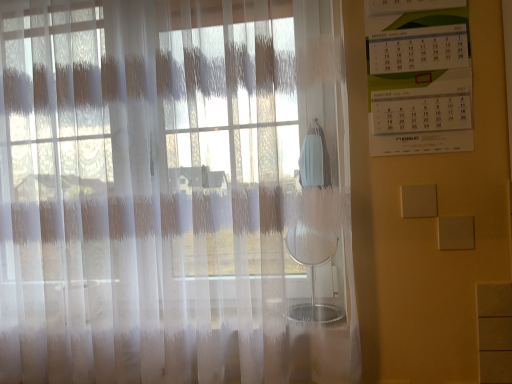
What do you see at coordinates (419, 78) in the screenshot? The width and height of the screenshot is (512, 384). I see `white paper calendar at upper right` at bounding box center [419, 78].

Identify the location of white paper calendar at upper right. This screenshot has height=384, width=512. (419, 78).

Describe the element at coordinates (173, 193) in the screenshot. I see `translucent white curtain at left` at that location.

The image size is (512, 384). In order to click on translucent white curtain at left in this screenshot , I will do `click(173, 193)`.

What are the coordinates of `white paper calendar at upper right` in the screenshot? It's located at (419, 78).

Considering the positions of objects white paper calendar at upper right and translucent white curtain at left in the image provided, who is more to the right, white paper calendar at upper right or translucent white curtain at left?

From the viewer's perspective, white paper calendar at upper right appears more on the right side.

Between white paper calendar at upper right and translucent white curtain at left, which one is positioned in front?

translucent white curtain at left is more forward.

Does point (460, 127) come in front of point (255, 0)?

No, (460, 127) is behind (255, 0).

From the image's perspective, between white paper calendar at upper right and translucent white curtain at left, which one is located above?

white paper calendar at upper right is shown above in the image.

From a real-world perspective, is white paper calendar at upper right positioned under translucent white curtain at left based on gravity?

Actually, white paper calendar at upper right is physically above translucent white curtain at left in the real world.

Is white paper calendar at upper right wider than translucent white curtain at left?

No, white paper calendar at upper right is not wider than translucent white curtain at left.

Consider the image. Considering the sizes of objects white paper calendar at upper right and translucent white curtain at left in the image provided, who is taller, white paper calendar at upper right or translucent white curtain at left?

translucent white curtain at left.

Can you confirm if white paper calendar at upper right is smaller than translucent white curtain at left?

Yes, white paper calendar at upper right is smaller than translucent white curtain at left.

Is translucent white curtain at left a part of white paper calendar at upper right?

No, translucent white curtain at left is not a part of white paper calendar at upper right.

Are white paper calendar at upper right and translucent white curtain at left beside each other?

white paper calendar at upper right is not next to translucent white curtain at left, and they're not touching.

Does white paper calendar at upper right turn towards translucent white curtain at left?

No, white paper calendar at upper right is not turned towards translucent white curtain at left.

How many degrees apart are the facing directions of white paper calendar at upper right and translucent white curtain at left?

The facing directions of white paper calendar at upper right and translucent white curtain at left are 1.9 degrees apart.

Measure the distance between white paper calendar at upper right and translucent white curtain at left.

A distance of 20.79 inches exists between white paper calendar at upper right and translucent white curtain at left.

Identify the location of bulletin board above the translucent white curtain at left (from a real-world perspective). This screenshot has height=384, width=512. (419, 78).

Does translucent white curtain at left appear on the right side of white paper calendar at upper right?

No.

Looking at this image, considering the relative positions of translucent white curtain at left and white paper calendar at upper right in the image provided, is translucent white curtain at left in front of white paper calendar at upper right?

That is True.

Is point (34, 158) in front of point (443, 24)?

No, (34, 158) is behind (443, 24).

From the image's perspective, does translucent white curtain at left appear lower than white paper calendar at upper right?

Correct, translucent white curtain at left appears lower than white paper calendar at upper right in the image.

From a real-world perspective, is translucent white curtain at left above or below white paper calendar at upper right?

translucent white curtain at left is situated lower than white paper calendar at upper right in the real world.

Is translucent white curtain at left wider or thinner than white paper calendar at upper right?

In the image, translucent white curtain at left appears to be wider than white paper calendar at upper right.

From the picture: Between translucent white curtain at left and white paper calendar at upper right, which one has more height?

translucent white curtain at left is taller.

In the scene shown: Is translucent white curtain at left smaller than white paper calendar at upper right?

Actually, translucent white curtain at left might be larger than white paper calendar at upper right.

Can white paper calendar at upper right be found inside translucent white curtain at left?

No, white paper calendar at upper right is not a part of translucent white curtain at left.

Is translucent white curtain at left next to white paper calendar at upper right?

No, translucent white curtain at left is not in contact with white paper calendar at upper right.

Is translucent white curtain at left facing towards white paper calendar at upper right?

No, translucent white curtain at left is not aimed at white paper calendar at upper right.

Measure the distance from translucent white curtain at left to white paper calendar at upper right.

translucent white curtain at left is 20.79 inches away from white paper calendar at upper right.

Identify the location of curtain located in front of the white paper calendar at upper right. The image size is (512, 384). (173, 193).

The image size is (512, 384). I want to click on bulletin board above the translucent white curtain at left (from the image's perspective), so click(419, 78).

At what (x,y) coordinates should I click in order to perform the action: click on curtain lying on the left of white paper calendar at upper right. Please return your answer as a coordinate pair (x, y). The height and width of the screenshot is (384, 512). Looking at the image, I should click on (173, 193).